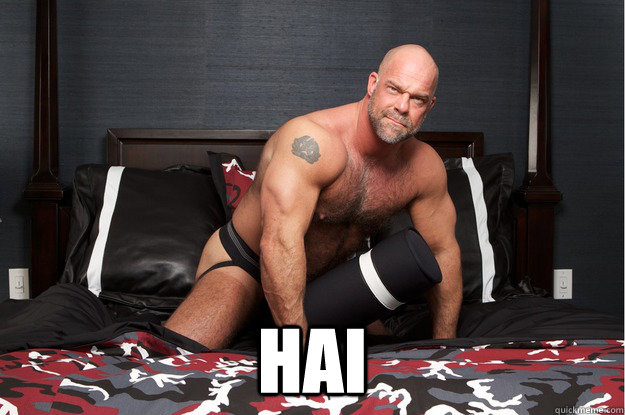
Where is `bolster`? bolster is located at coordinates (386, 276).